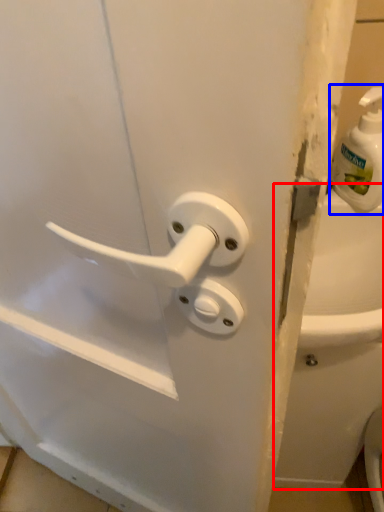
Question: Which point is further to the camera, bath (highlighted by a red box) or soap dispenser (highlighted by a blue box)?

Choices:
 (A) bath
 (B) soap dispenser

Answer: (A)